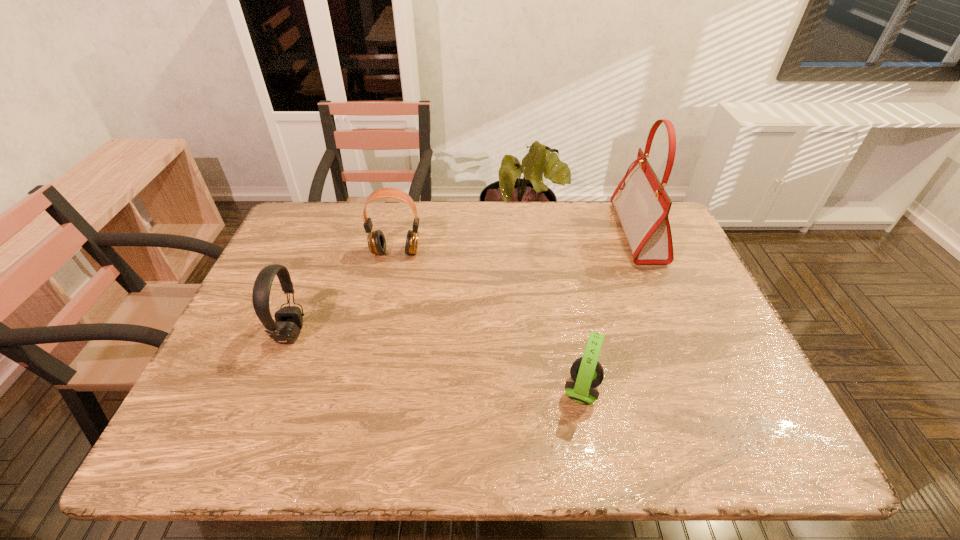
Find the location of a particular element. The width and height of the screenshot is (960, 540). vacant space at the right edge of the desktop is located at coordinates (685, 391).

Find the location of a particular element. This screenshot has width=960, height=540. vacant point at the far left corner is located at coordinates (308, 225).

In the image, there is a desktop. Where is `free region at the far right corner`? free region at the far right corner is located at coordinates (684, 248).

In the image, there is a desktop. Where is `free space at the near right corner`? Image resolution: width=960 pixels, height=540 pixels. free space at the near right corner is located at coordinates (776, 420).

This screenshot has width=960, height=540. Find the location of `free point between the rightmost object and the third object from left to right`. free point between the rightmost object and the third object from left to right is located at coordinates (610, 312).

Identify the location of empty space that is in between the nearest object and the leftmost headset. tap(437, 362).

Image resolution: width=960 pixels, height=540 pixels. I want to click on free space between the handbag and the farthest headset, so click(516, 242).

This screenshot has width=960, height=540. Identify the location of free space between the leftmost headset and the nearest object. (437, 362).

This screenshot has height=540, width=960. Find the location of `free space between the shortest object and the handbag`. free space between the shortest object and the handbag is located at coordinates (610, 312).

I want to click on free area in between the third object from right to left and the handbag, so click(516, 242).